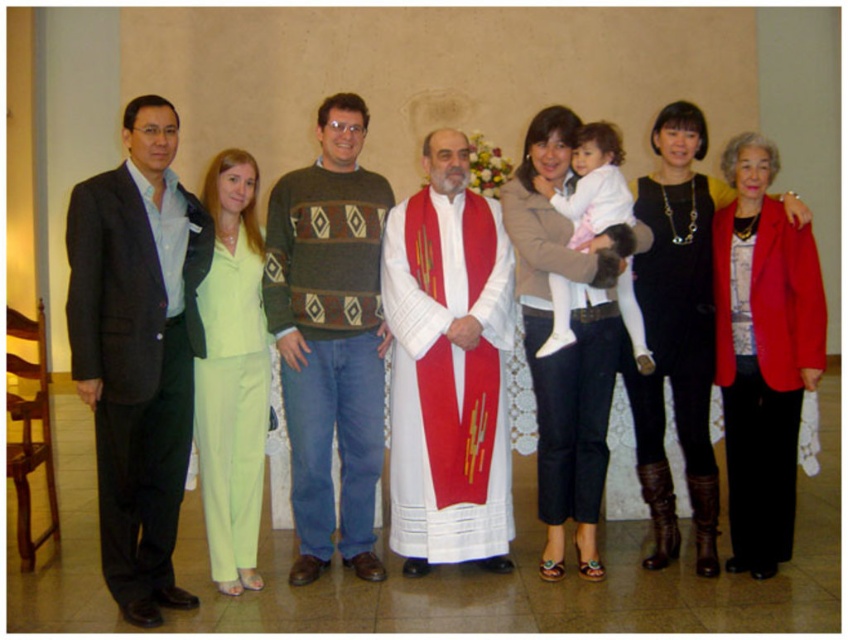
Can you confirm if knit sweater at center is positioned below matte beige jacket at center?

No.

Which is below, knit sweater at center or matte beige jacket at center?

matte beige jacket at center is below.

Measure the distance between knit sweater at center and camera.

4.71 meters

I want to click on knit sweater at center, so click(x=330, y=337).

Does black leather boots at right have a greater width compared to linen green pants at center?

Indeed, black leather boots at right has a greater width compared to linen green pants at center.

What do you see at coordinates (676, 332) in the screenshot? I see `black leather boots at right` at bounding box center [676, 332].

Is point (706, 284) positioned behind point (221, 180)?

Yes, point (706, 284) is farther from viewer.

At what (x,y) coordinates should I click in order to perform the action: click on black leather boots at right. Please return your answer as a coordinate pair (x, y). Image resolution: width=848 pixels, height=640 pixels. Looking at the image, I should click on (x=676, y=332).

Image resolution: width=848 pixels, height=640 pixels. What do you see at coordinates (330, 337) in the screenshot? I see `knit sweater at center` at bounding box center [330, 337].

Is point (310, 417) positioned after point (817, 353)?

Yes, point (310, 417) is behind point (817, 353).

Describe the element at coordinates (330, 337) in the screenshot. I see `knit sweater at center` at that location.

I want to click on knit sweater at center, so click(330, 337).